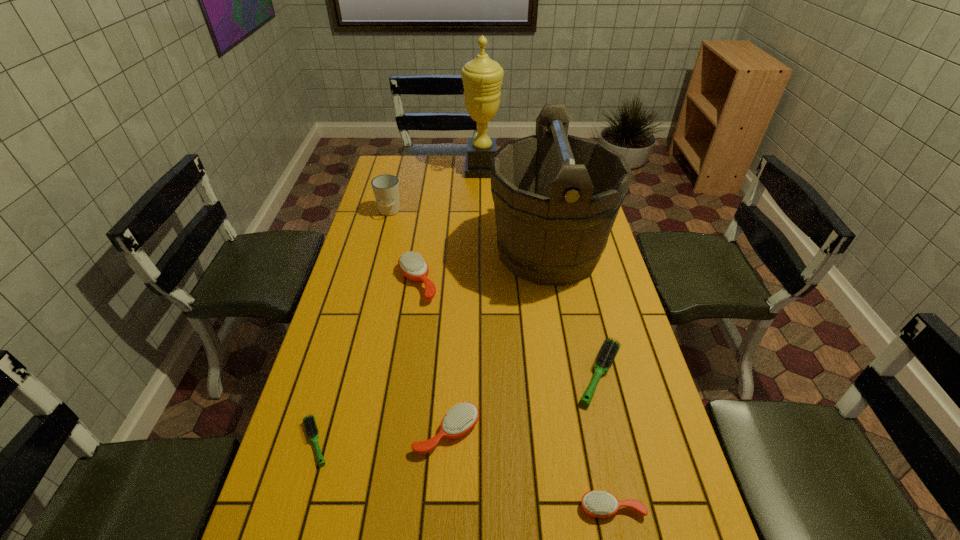
The height and width of the screenshot is (540, 960). What are the coordinates of `the farther light hairbrush` in the screenshot? It's located at (609, 349).

The image size is (960, 540). I want to click on the nearest orange hairbrush, so click(601, 504).

Identify the location of the smallest orange hairbrush. This screenshot has width=960, height=540. (601, 504).

The width and height of the screenshot is (960, 540). Find the location of `the left light hairbrush`. the left light hairbrush is located at coordinates (309, 422).

Locate an element on the screen. This screenshot has width=960, height=540. the smaller light hairbrush is located at coordinates coord(309,422).

Where is `free space located at the front of the tallest object with handles`? The width and height of the screenshot is (960, 540). free space located at the front of the tallest object with handles is located at coordinates 423,169.

At what (x,y) coordinates should I click in order to perform the action: click on free space located 0.080m at the front of the tallest object with handles. Please return your answer as a coordinate pair (x, y). The width and height of the screenshot is (960, 540). Looking at the image, I should click on (445, 169).

Identify the location of blank space located at the front of the tallest object with handles. The height and width of the screenshot is (540, 960). (384, 169).

Identify the location of free space located on the front of the bucket. The image size is (960, 540). (569, 369).

What are the coordinates of `free region located 0.310m with a handle on the side of the white cup` in the screenshot? It's located at (372, 275).